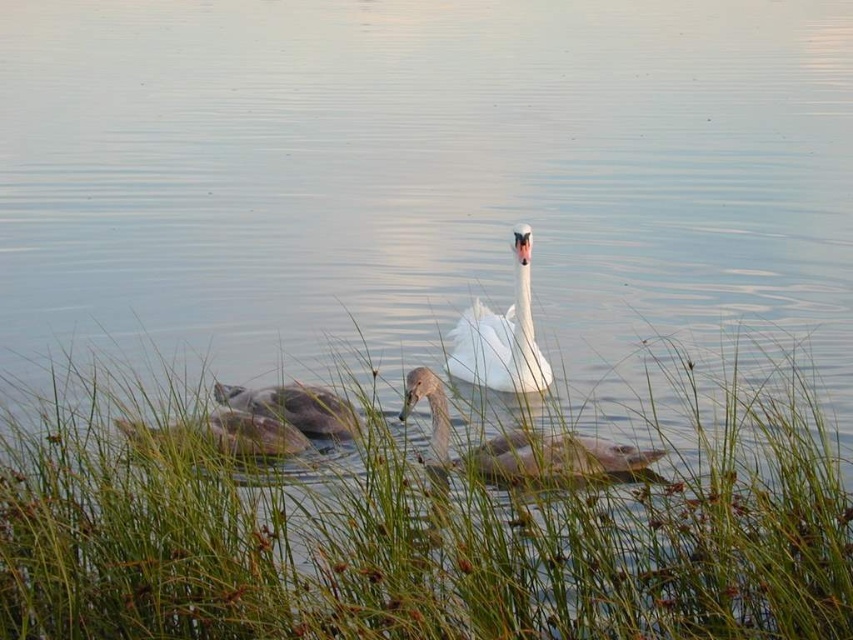
Question: Which point is farther from the camera taking this photo?

Choices:
 (A) (252, 440)
 (B) (529, 378)
 (C) (526, 433)

Answer: (B)

Question: Observing the image, what is the correct spatial positioning of gray matte duck at lower center in reference to gray matte duck at lower left?

Choices:
 (A) above
 (B) below

Answer: (B)

Question: Among these objects, which one is nearest to the camera?

Choices:
 (A) green grass at lower center
 (B) gray matte duck at lower center

Answer: (A)

Question: Among these objects, which one is farthest from the camera?

Choices:
 (A) gray matte duck at lower left
 (B) gray matte duck at center

Answer: (A)

Question: Can you confirm if gray matte duck at center is positioned below gray matte duck at lower center?

Choices:
 (A) no
 (B) yes

Answer: (B)

Question: Observing the image, what is the correct spatial positioning of gray matte duck at center in reference to gray matte duck at lower left?

Choices:
 (A) right
 (B) left

Answer: (A)